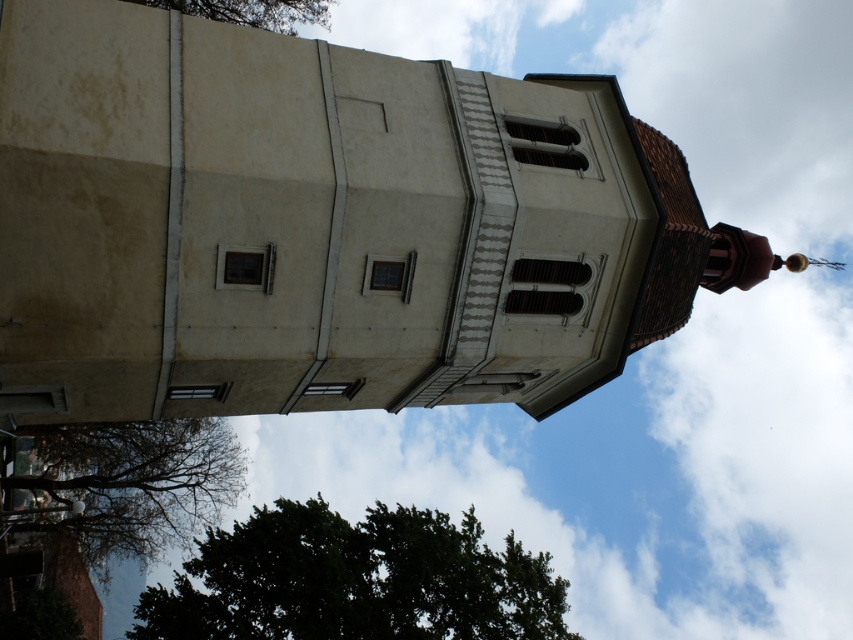
Who is positioned more to the right, dark green leafy tree at lower left or green leafy tree at lower left?

Positioned to the right is dark green leafy tree at lower left.

Can you confirm if dark green leafy tree at lower left is smaller than green leafy tree at lower left?

No.

Image resolution: width=853 pixels, height=640 pixels. I want to click on dark green leafy tree at lower left, so click(357, 580).

Measure the distance between point (x=91, y=525) and camera.

Point (x=91, y=525) and camera are 70.48 meters apart from each other.

Between green leafy tree at lower left and green leafy tree at upper center, which one appears on the left side from the viewer's perspective?

From the viewer's perspective, green leafy tree at lower left appears more on the left side.

Is point (184, 520) farther from viewer compared to point (270, 8)?

Yes, point (184, 520) is farther from viewer.

The height and width of the screenshot is (640, 853). What are the coordinates of `green leafy tree at lower left` in the screenshot? It's located at (120, 484).

Which of these two, dark green leafy tree at lower left or green leafy tree at upper center, stands shorter?

green leafy tree at upper center

Between dark green leafy tree at lower left and green leafy tree at upper center, which one appears on the left side from the viewer's perspective?

green leafy tree at upper center is more to the left.

Which is in front, point (430, 600) or point (248, 19)?

Point (430, 600) is in front.

This screenshot has height=640, width=853. Identify the location of dark green leafy tree at lower left. (357, 580).